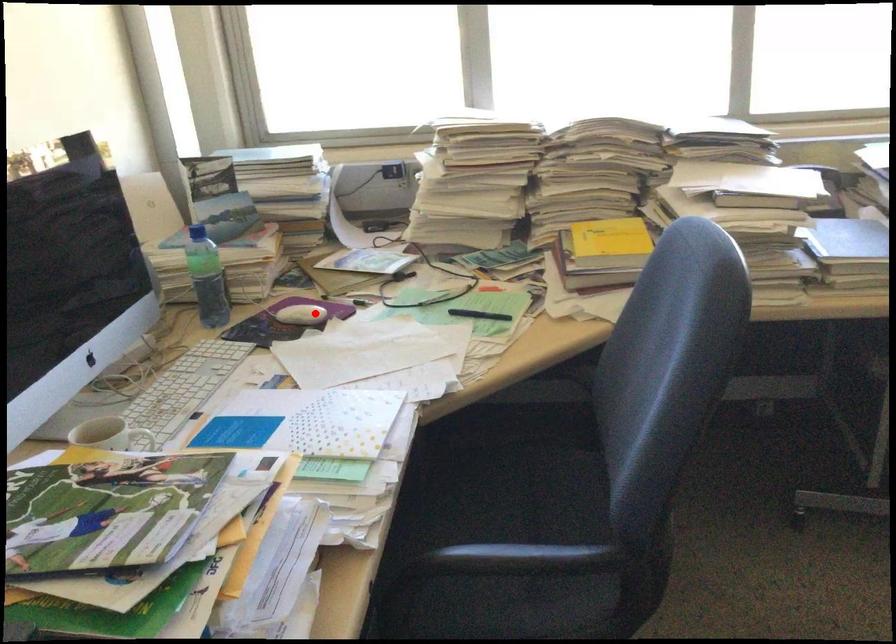
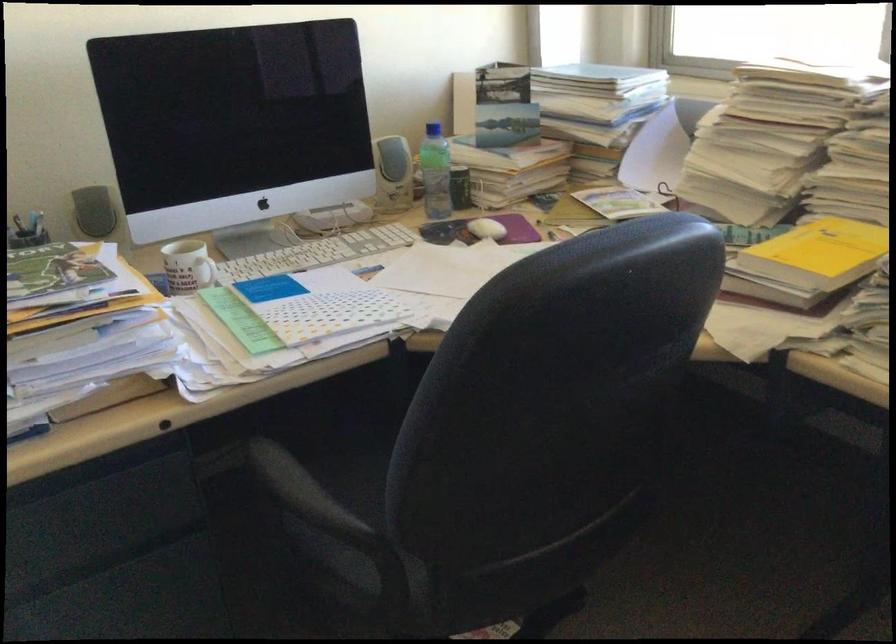
In the second image, find the point that corresponds to the highlighted location in the first image.

(487, 229)